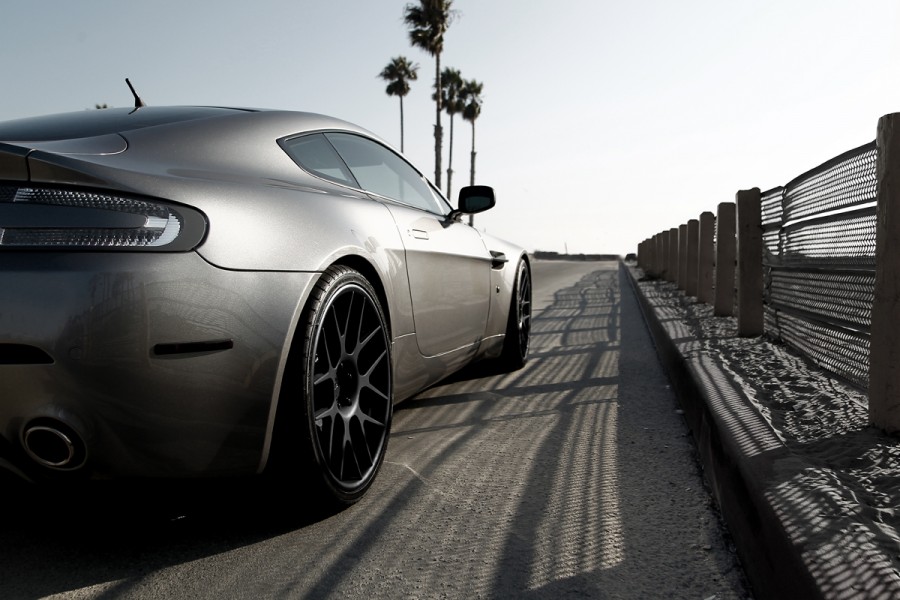
Locate an element on the screen. The width and height of the screenshot is (900, 600). door is located at coordinates (425, 288).